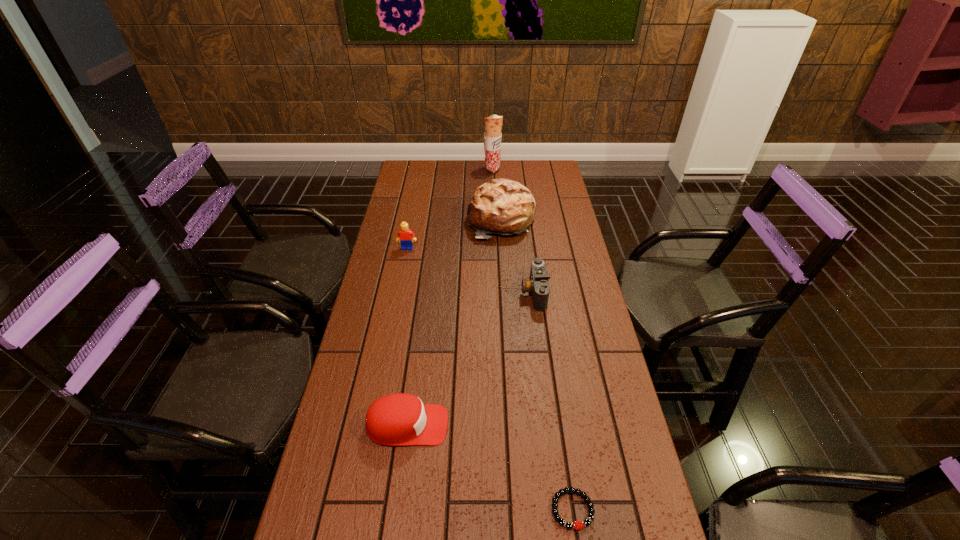
Identify the location of baseball cap that is at the left edge. (400, 419).

At what (x,y) coordinates should I click in order to perform the action: click on bread at the right edge. Please return your answer as a coordinate pair (x, y). The width and height of the screenshot is (960, 540). Looking at the image, I should click on (502, 206).

The height and width of the screenshot is (540, 960). What are the coordinates of `camera that is at the right edge` in the screenshot? It's located at (538, 284).

This screenshot has height=540, width=960. I want to click on bracelet at the right edge, so click(577, 525).

Where is `vacant area at the far edge of the desktop`? This screenshot has width=960, height=540. vacant area at the far edge of the desktop is located at coordinates (460, 176).

In the image, there is a desktop. Where is `vacant space at the left edge`? vacant space at the left edge is located at coordinates (385, 244).

Locate an element on the screen. vacant space at the right edge of the desktop is located at coordinates (533, 192).

At what (x,y) coordinates should I click in order to perform the action: click on vacant space at the far left corner. Please return your answer as a coordinate pair (x, y). Image resolution: width=960 pixels, height=540 pixels. Looking at the image, I should click on (415, 164).

Identify the location of vacant area at the far right corner. (528, 181).

The height and width of the screenshot is (540, 960). Find the location of `free space that is in between the fourth farthest object and the nearest object`. free space that is in between the fourth farthest object and the nearest object is located at coordinates (553, 401).